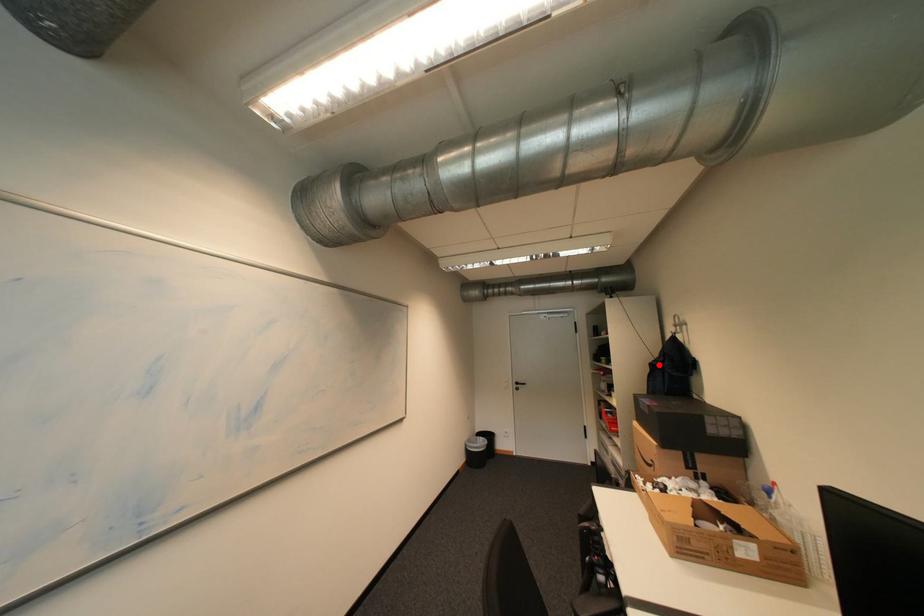
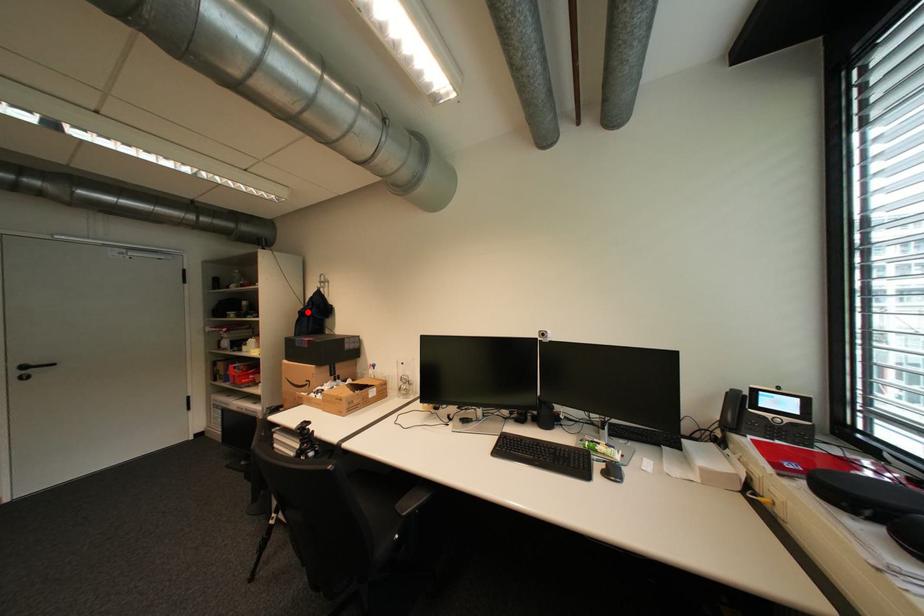
I am providing you with two images of the same scene from different viewpoints. A red point is marked on the first image and another point is marked on the second image. Do the highlighted points in image1 and image2 indicate the same real-world spot?

Yes